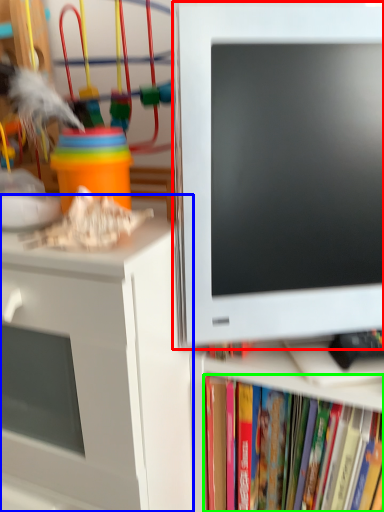
Question: Considering the real-world distances, which object is farthest from computer monitor (highlighted by a red box)? desk (highlighted by a blue box) or book (highlighted by a green box)?

Choices:
 (A) desk
 (B) book

Answer: (B)